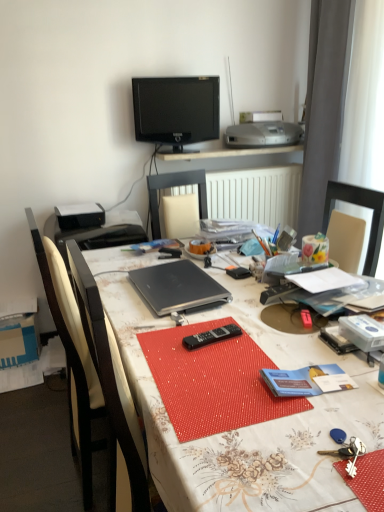
Question: Is black plastic remote at center touching satin silver printer at upper center?

Choices:
 (A) no
 (B) yes

Answer: (A)

Question: Can you confirm if black plastic remote at center is thinner than satin silver printer at upper center?

Choices:
 (A) no
 (B) yes

Answer: (B)

Question: Is black plastic remote at center bigger than satin silver printer at upper center?

Choices:
 (A) no
 (B) yes

Answer: (A)

Question: Is black plastic remote at center aimed at satin silver printer at upper center?

Choices:
 (A) yes
 (B) no

Answer: (B)

Question: Is black plastic remote at center taller than satin silver printer at upper center?

Choices:
 (A) no
 (B) yes

Answer: (A)

Question: In the image, is black plastic remote at center on the left side or the right side of black matte laptop at center?

Choices:
 (A) right
 (B) left

Answer: (A)

Question: From the image's perspective, is black plastic remote at center located above or below black matte laptop at center?

Choices:
 (A) below
 (B) above

Answer: (A)

Question: Considering the positions of black plastic remote at center and black matte laptop at center in the image, is black plastic remote at center wider or thinner than black matte laptop at center?

Choices:
 (A) thin
 (B) wide

Answer: (A)

Question: Is black plastic remote at center taller or shorter than black matte laptop at center?

Choices:
 (A) short
 (B) tall

Answer: (A)

Question: Is black wood chair at left wider or thinner than black matte laptop at center?

Choices:
 (A) thin
 (B) wide

Answer: (B)

Question: From the image's perspective, is black wood chair at left positioned above or below black matte laptop at center?

Choices:
 (A) below
 (B) above

Answer: (A)

Question: Does point (51, 308) appear closer or farther from the camera than point (168, 262)?

Choices:
 (A) farther
 (B) closer

Answer: (B)

Question: In the image, is black wood chair at left positioned in front of or behind black matte laptop at center?

Choices:
 (A) front
 (B) behind

Answer: (A)

Question: Considering their positions, is matte black laptop at center located in front of or behind black plastic remote at center?

Choices:
 (A) behind
 (B) front

Answer: (B)

Question: In terms of height, does matte black laptop at center look taller or shorter compared to black plastic remote at center?

Choices:
 (A) tall
 (B) short

Answer: (A)